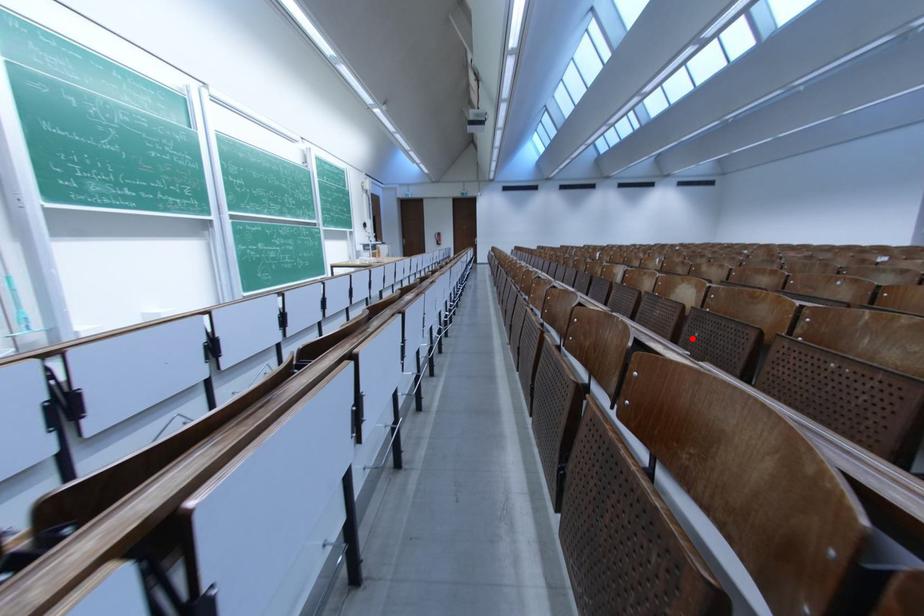
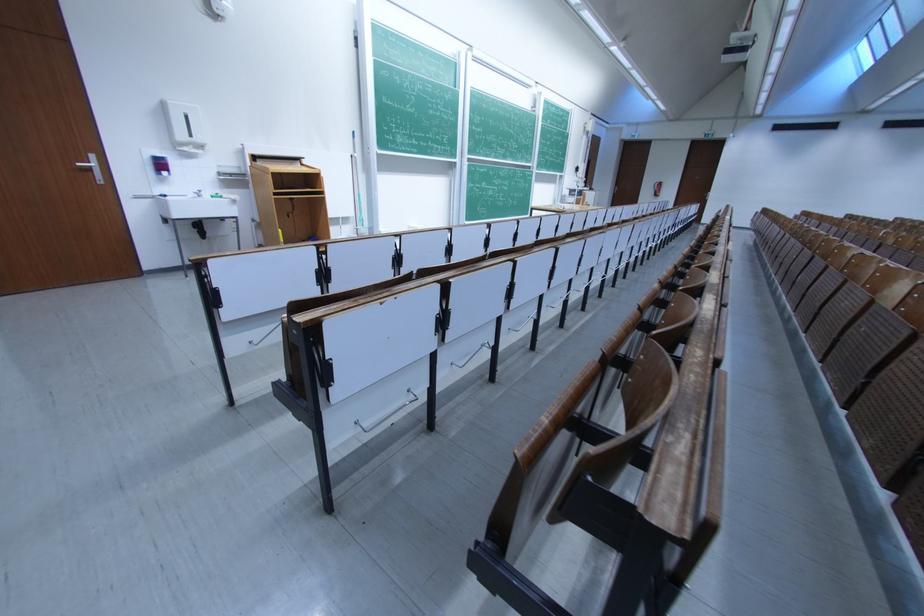
In the second image, find the point that corresponds to the highlighted location in the first image.

(860, 331)